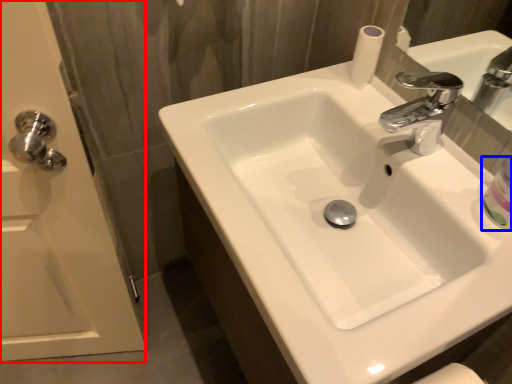
Question: Which object appears closest to the camera in this image, screen door (highlighted by a red box) or mouthwash (highlighted by a blue box)?

Choices:
 (A) screen door
 (B) mouthwash

Answer: (A)